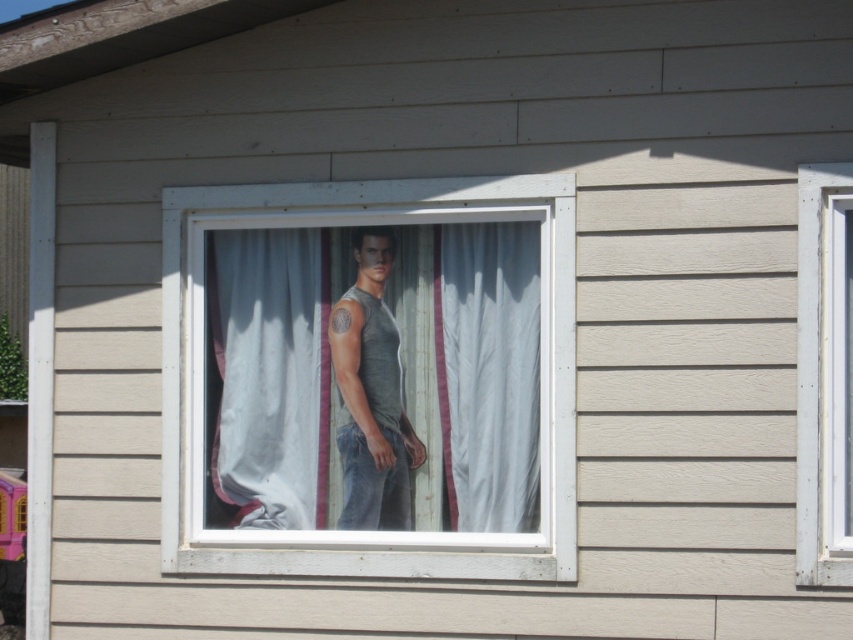
You are an interior designer assessing the window display of a house. You notice the matte gray tank top at center and the white sheer fabric at center. Which object is positioned higher in the scene?

The matte gray tank top at center is much taller than the white sheer fabric at center, so the matte gray tank top at center is positioned higher in the scene.

You are a tailor measuring fabrics for a project. You have a piece of matte gray tank top at center and a piece of white sheer fabric at center. Which fabric is wider?

The matte gray tank top at center might be wider than white sheer fabric at center according to the description.

You are standing in front of the beige house with the window framed by white trim. You notice a point marked at coordinates (267, 376). What is this point located on?

The point at (267, 376) is located on the white sheer fabric at center.